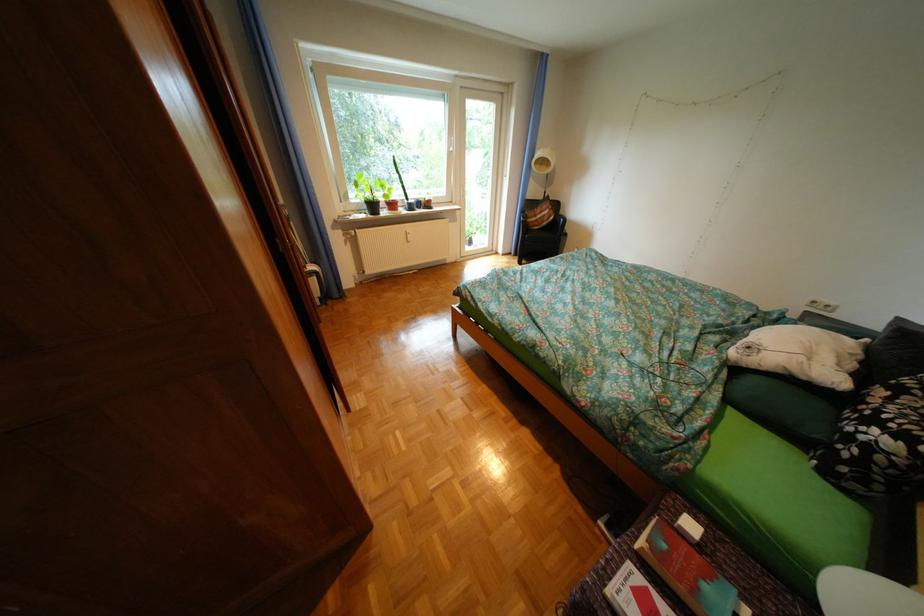
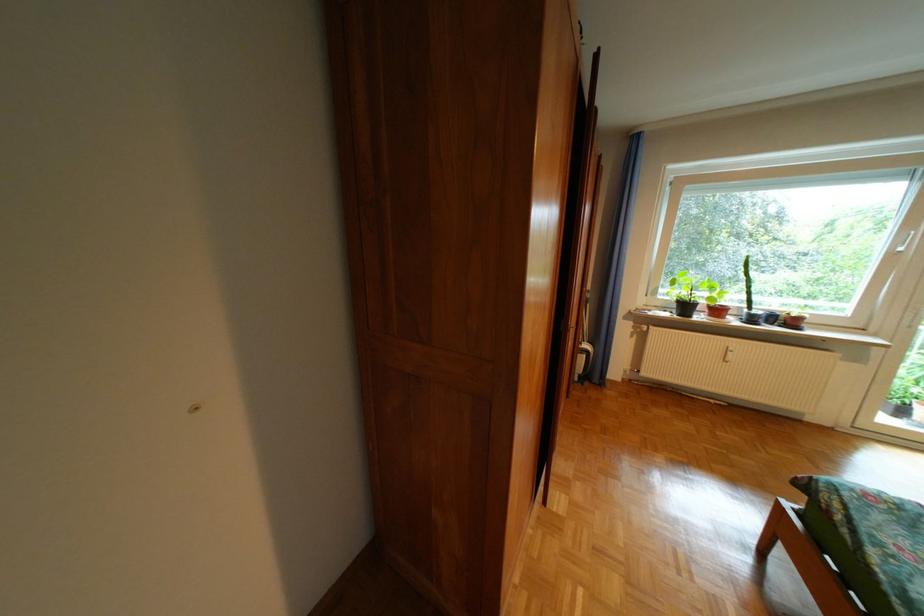
Locate, in the second image, the point that corresponds to point 399,214 in the first image.

(714, 318)